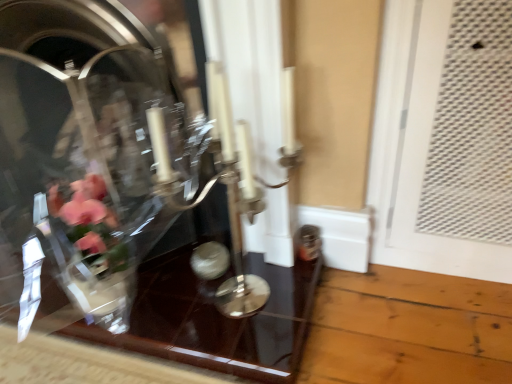
Question: Is clear glass vase at center not inside transparent glass table at center?

Choices:
 (A) no
 (B) yes

Answer: (B)

Question: From a real-world perspective, does clear glass vase at center sit lower than transparent glass table at center?

Choices:
 (A) yes
 (B) no

Answer: (B)

Question: From a real-world perspective, is clear glass vase at center located higher than transparent glass table at center?

Choices:
 (A) no
 (B) yes

Answer: (B)

Question: Considering the relative sizes of clear glass vase at center and transparent glass table at center in the image provided, is clear glass vase at center smaller than transparent glass table at center?

Choices:
 (A) no
 (B) yes

Answer: (A)

Question: Is clear glass vase at center facing towards transparent glass table at center?

Choices:
 (A) yes
 (B) no

Answer: (A)

Question: From the image's perspective, is clear glass vase at center over transparent glass table at center?

Choices:
 (A) no
 (B) yes

Answer: (B)

Question: Does silver metallic candle holder at center turn towards clear glass vase at center?

Choices:
 (A) no
 (B) yes

Answer: (A)

Question: From the image's perspective, would you say silver metallic candle holder at center is shown under clear glass vase at center?

Choices:
 (A) no
 (B) yes

Answer: (B)

Question: Is silver metallic candle holder at center far away from clear glass vase at center?

Choices:
 (A) no
 (B) yes

Answer: (A)

Question: From the image's perspective, is silver metallic candle holder at center over clear glass vase at center?

Choices:
 (A) no
 (B) yes

Answer: (A)

Question: Is silver metallic candle holder at center completely or partially outside of clear glass vase at center?

Choices:
 (A) yes
 (B) no

Answer: (A)

Question: Is clear glass vase at center completely or partially inside silver metallic candle holder at center?

Choices:
 (A) no
 (B) yes

Answer: (A)

Question: Is transparent glass table at center positioned with its back to silver metallic candle holder at center?

Choices:
 (A) yes
 (B) no

Answer: (B)